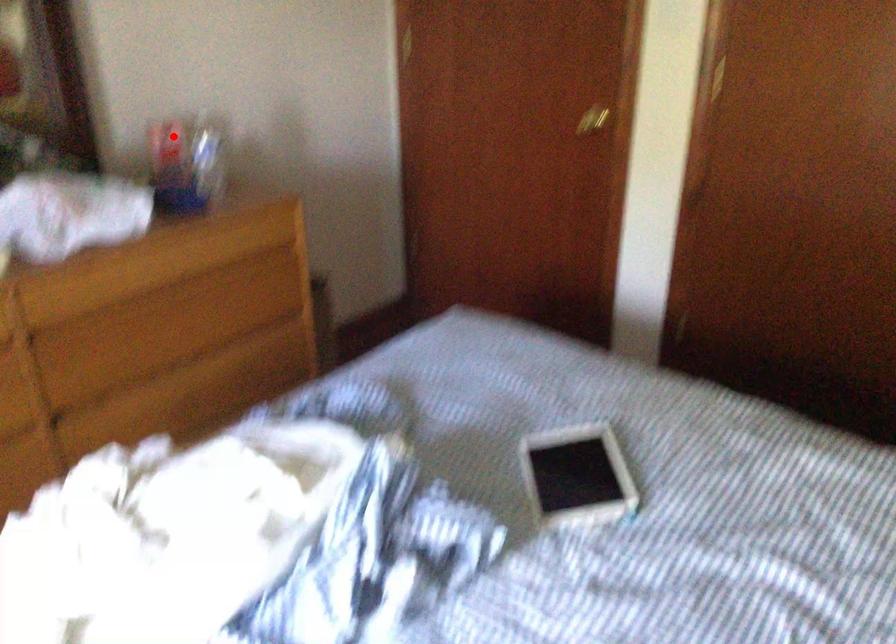
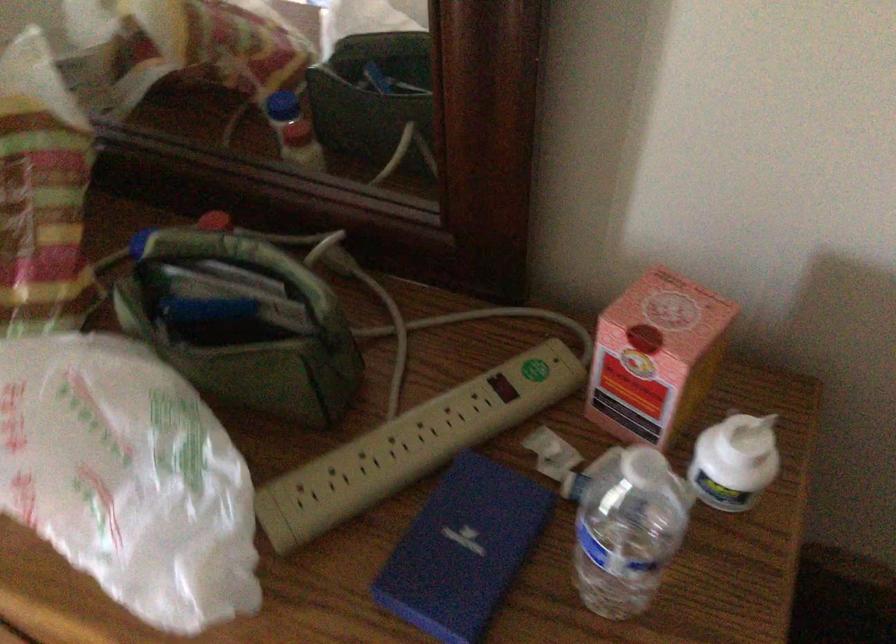
Find the pixel in the second image that matches the highlighted location in the first image.

(656, 357)